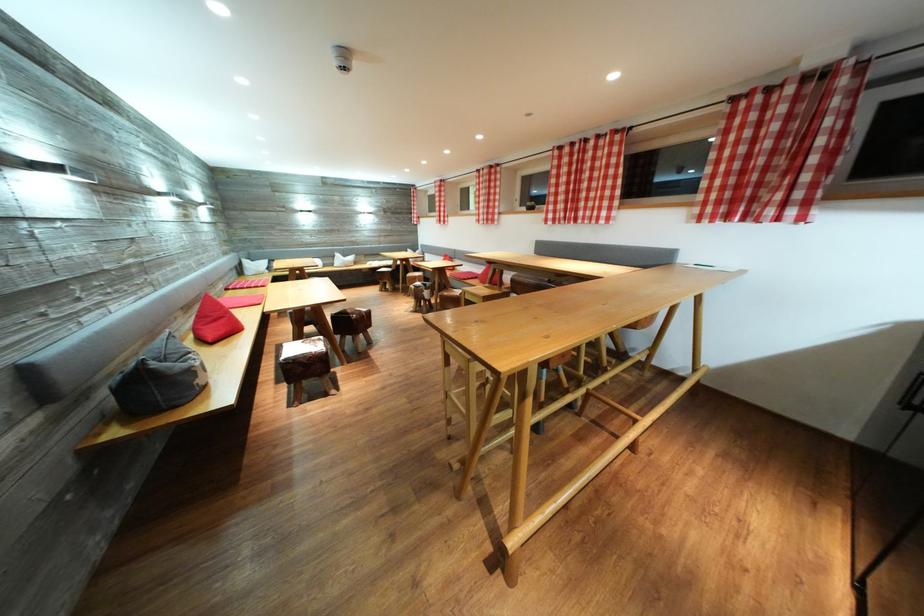
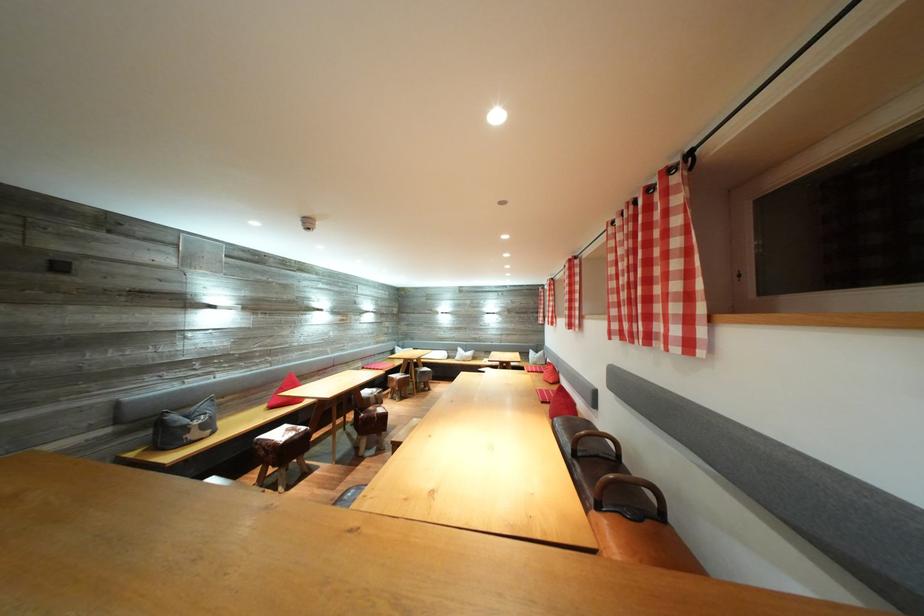
Where in the second image is the point corresponding to (x=432, y=188) from the first image?

(553, 288)